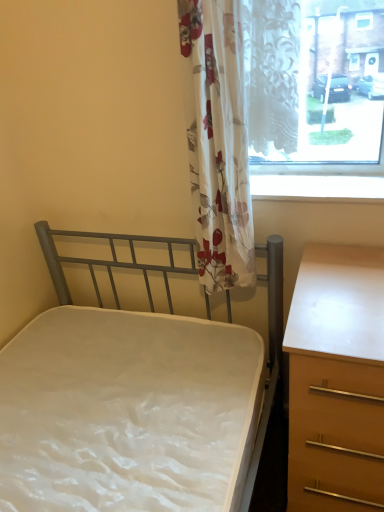
Question: Is metallic gray bed at center-left turned away from light brown wood chest of drawers at right?

Choices:
 (A) no
 (B) yes

Answer: (A)

Question: Is metallic gray bed at center-left thinner than light brown wood chest of drawers at right?

Choices:
 (A) yes
 (B) no

Answer: (B)

Question: Can you confirm if metallic gray bed at center-left is bigger than light brown wood chest of drawers at right?

Choices:
 (A) yes
 (B) no

Answer: (A)

Question: Could you tell me if metallic gray bed at center-left is facing light brown wood chest of drawers at right?

Choices:
 (A) no
 (B) yes

Answer: (A)

Question: Is the depth of metallic gray bed at center-left greater than that of light brown wood chest of drawers at right?

Choices:
 (A) no
 (B) yes

Answer: (A)

Question: Is metallic gray bed at center-left at the left side of light brown wood chest of drawers at right?

Choices:
 (A) no
 (B) yes

Answer: (B)

Question: Is light brown wood chest of drawers at right positioned far away from floral fabric curtain at center?

Choices:
 (A) no
 (B) yes

Answer: (A)

Question: Is light brown wood chest of drawers at right taller than floral fabric curtain at center?

Choices:
 (A) yes
 (B) no

Answer: (B)

Question: Is light brown wood chest of drawers at right smaller than floral fabric curtain at center?

Choices:
 (A) no
 (B) yes

Answer: (A)

Question: Is light brown wood chest of drawers at right thinner than floral fabric curtain at center?

Choices:
 (A) yes
 (B) no

Answer: (B)

Question: Is light brown wood chest of drawers at right looking in the opposite direction of floral fabric curtain at center?

Choices:
 (A) no
 (B) yes

Answer: (A)

Question: Is light brown wood chest of drawers at right further to camera compared to floral fabric curtain at center?

Choices:
 (A) no
 (B) yes

Answer: (A)

Question: Does metallic gray bed at center-left have a greater height compared to white glossy window sill at upper center?

Choices:
 (A) no
 (B) yes

Answer: (B)